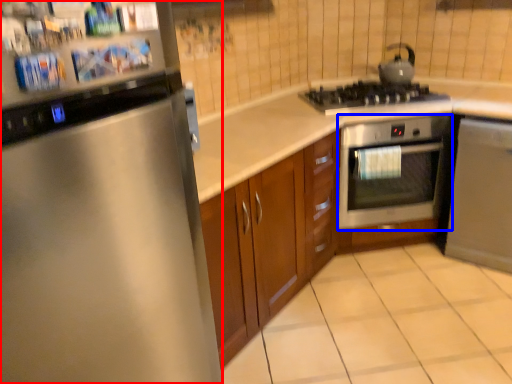
Question: Which object is closer to the camera taking this photo, home appliance (highlighted by a red box) or oven (highlighted by a blue box)?

Choices:
 (A) home appliance
 (B) oven

Answer: (A)